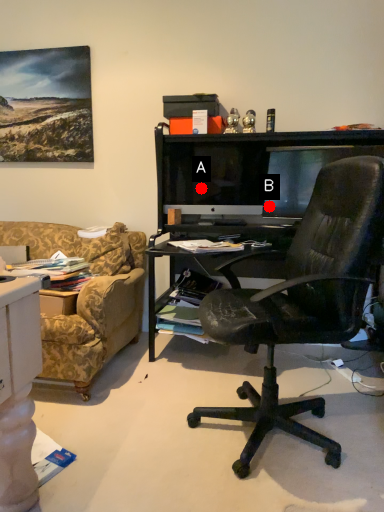
Question: Two points are circled on the image, labeled by A and B beside each circle. Among these points, which one is farthest from the camera?

Choices:
 (A) A is further
 (B) B is further

Answer: (A)